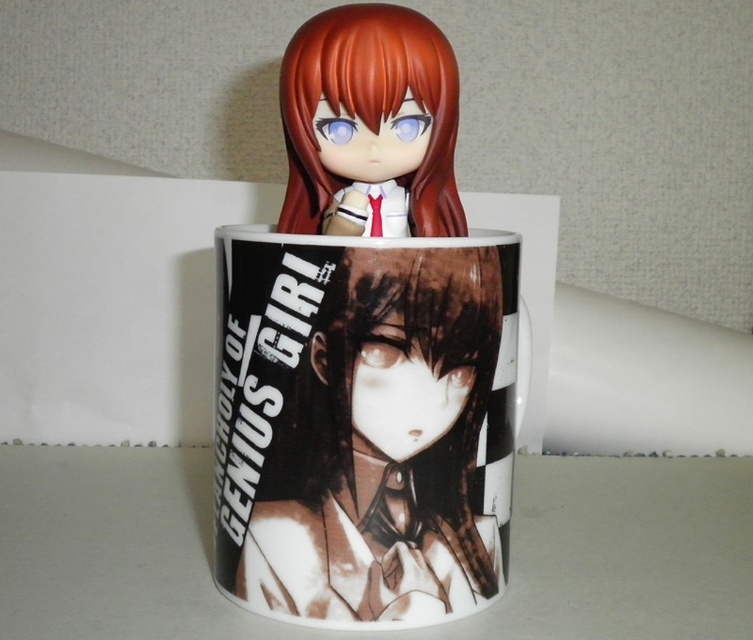
What do you see at coordinates (363, 424) in the screenshot?
I see `white glossy mug at center` at bounding box center [363, 424].

Is point (316, 605) positioned after point (453, 173)?

No, (316, 605) is closer to viewer.

Who is more distant from viewer, (488, 365) or (398, 10)?

The point (398, 10) is more distant.

The height and width of the screenshot is (640, 753). Find the location of `white glossy mug at center`. white glossy mug at center is located at coordinates (363, 424).